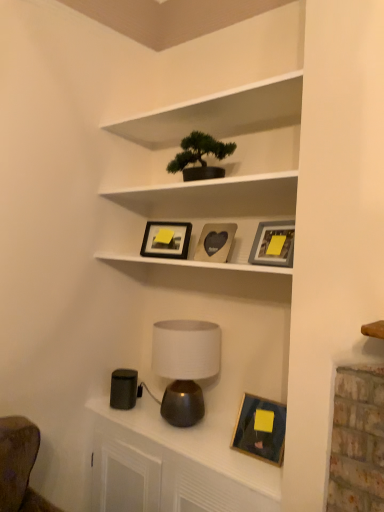
Identify the location of vacant space in front of wooden picture frame at lower right, positioned as the 1th picture frame in bottom-to-top order. (254, 473).